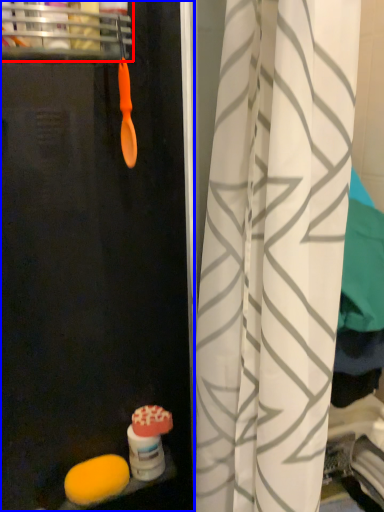
Question: Among these objects, which one is farthest to the camera, shelf (highlighted by a red box) or screen door (highlighted by a blue box)?

Choices:
 (A) shelf
 (B) screen door

Answer: (A)